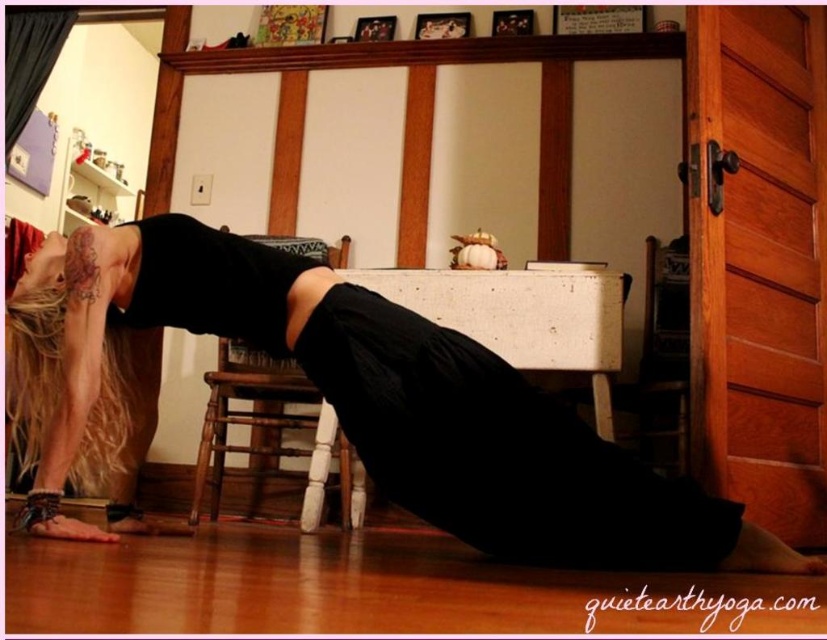
You are a photographer setting up a shoot in the room where the yoga pose is being performed. You need to place a small tripod between the black matte yoga mat at lower center and the black matte dress at lower center. Given that the tripod requires at least 30 cm of space, can you determine if there is enough space between them?

The black matte yoga mat at lower center is larger in size than the black matte dress at lower center, but the exact distance between them isn not specified. Therefore, it is uncertain if there is enough space for the tripod requiring 30 cm.

You are a photographer setting up for a yoga session. You have a black matte yoga mat at lower center and a white wood stool at center. The client wants to ensure the stool is visible in the shot. Based on their positions, will the yoga mat block the stool from view?

The black matte yoga mat at lower center is much taller than the white wood stool at center, so it will block the stool from view.

You are a fitness instructor observing the yoga session. The yoga mat is at coordinates 0.628, 0.423. If you want to place a water bottle on the edge of the black matte yoga mat at lower center, where should you position it relative to the mat?

The black matte yoga mat at lower center is located at point (349, 401). To place the water bottle on the edge, position it near the perimeter coordinates of the mat, such as along its length or width boundaries at those coordinates.